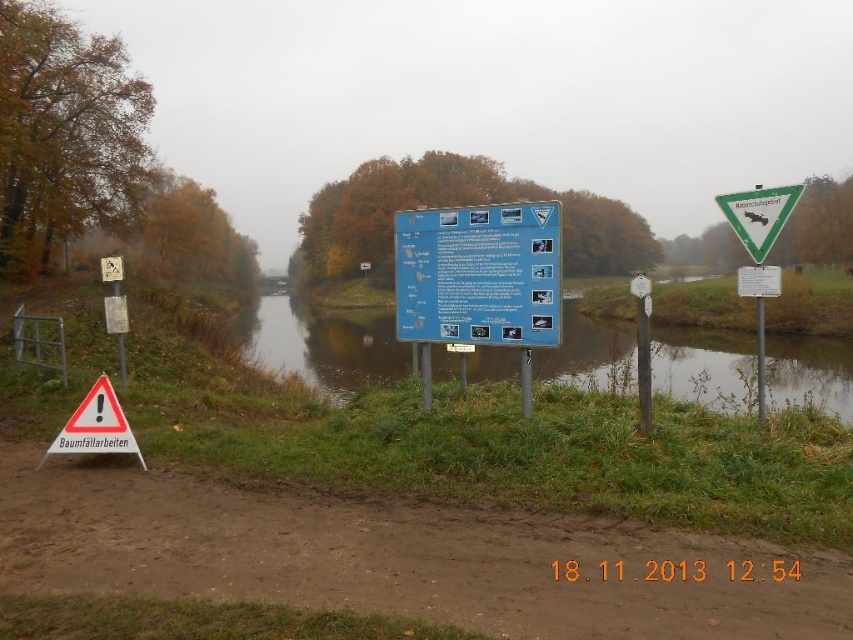
You are a hiker who wants to cross the greenish reflective water at center. There is a green plastic sign at upper right nearby. Which object is larger in size?

The greenish reflective water at center is bigger than the green plastic sign at upper right.

You are a hiker who wants to cross the greenish reflective water at center using the red reflective triangle at lower left. Is the triangle positioned in a way that allows you to step on it to cross the water?

The greenish reflective water at center is positioned over the red reflective triangle at lower left, meaning the triangle is underneath the water. Therefore, you cannot step on the red reflective triangle at lower left to cross the greenish reflective water at center because it is submerged.